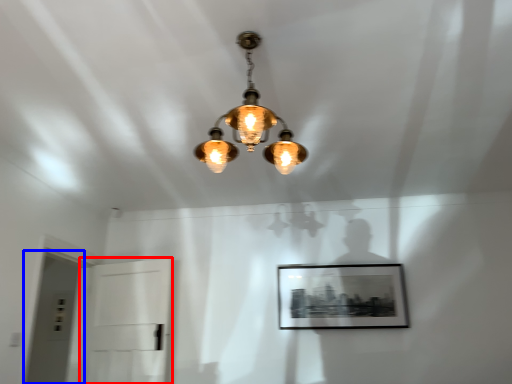
Question: Which point is further to the camera, glass door (highlighted by a red box) or glass door (highlighted by a blue box)?

Choices:
 (A) glass door
 (B) glass door

Answer: (A)